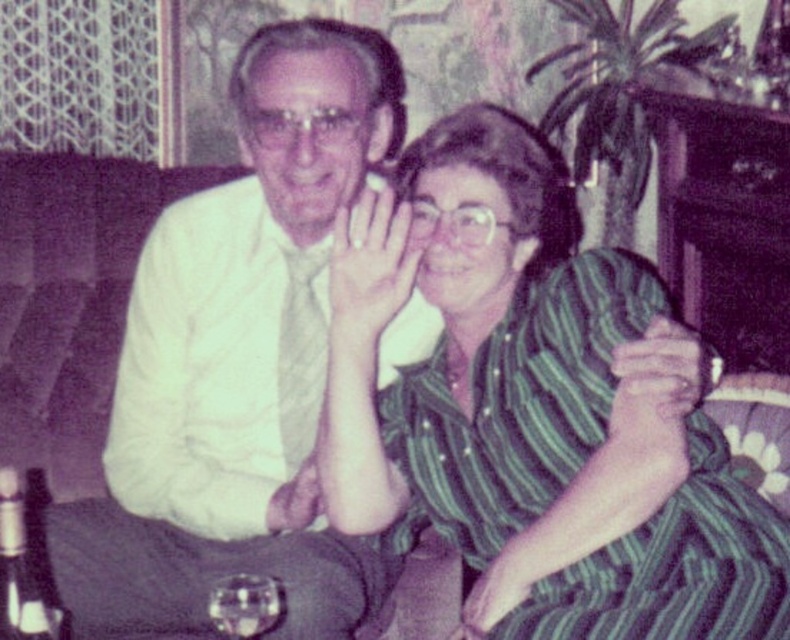
Question: Does green striped dress at center appear under clear glass bottle at lower left?

Choices:
 (A) no
 (B) yes

Answer: (A)

Question: Observing the image, what is the correct spatial positioning of white matte shirt at center in reference to clear glass bottle at lower left?

Choices:
 (A) left
 (B) right

Answer: (B)

Question: Estimate the real-world distances between objects in this image. Which object is farther from the transparent glass at lower center?

Choices:
 (A) white matte shirt at center
 (B) clear glass bottle at lower left
 (C) green striped dress at center

Answer: (C)

Question: Which point is closer to the camera?

Choices:
 (A) (226, 588)
 (B) (482, 634)
 (C) (17, 483)

Answer: (C)

Question: Can you confirm if green striped dress at center is positioned above clear glass bottle at lower left?

Choices:
 (A) no
 (B) yes

Answer: (B)

Question: Which is farther from the white matte shirt at center?

Choices:
 (A) green striped dress at center
 (B) transparent glass at lower center

Answer: (B)